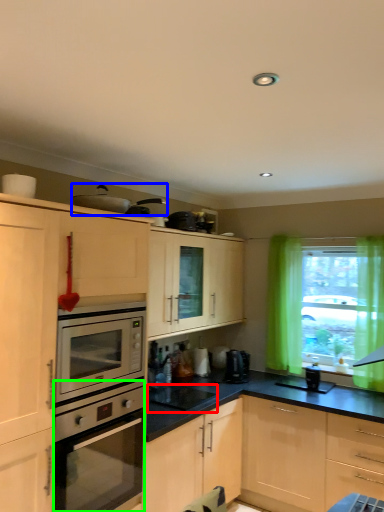
Question: Estimate the real-world distances between objects in this image. Which object is farther from appliance (highlighted by a red box), appliance (highlighted by a blue box) or oven (highlighted by a green box)?

Choices:
 (A) appliance
 (B) oven

Answer: (A)